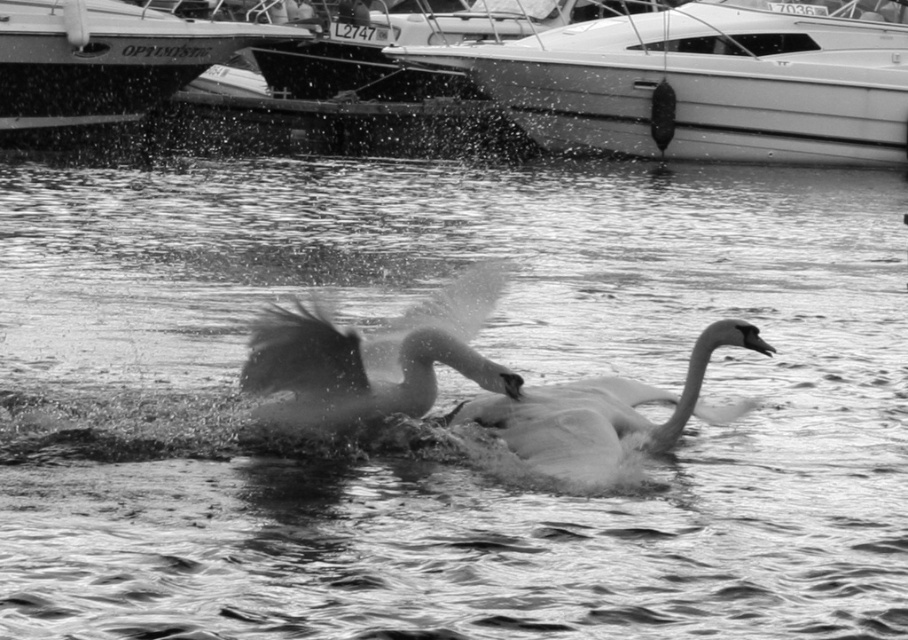
Question: Which point is closer to the camera?

Choices:
 (A) metallic boat at upper left
 (B) silvery feathered swan at center

Answer: (B)

Question: Does white glossy boat at upper center appear on the right side of metallic boat at upper left?

Choices:
 (A) yes
 (B) no

Answer: (A)

Question: Which object appears farthest from the camera in this image?

Choices:
 (A) white glossy boat at upper center
 (B) silvery feathered swan at center
 (C) metallic boat at upper left

Answer: (A)

Question: Is white glossy boat at upper center below smooth white swan at center?

Choices:
 (A) no
 (B) yes

Answer: (A)

Question: Which point is closer to the camera taking this photo?

Choices:
 (A) (588, 436)
 (B) (243, 381)

Answer: (A)

Question: Can you confirm if silvery feathered swan at center is positioned above smooth white swan at center?

Choices:
 (A) no
 (B) yes

Answer: (B)